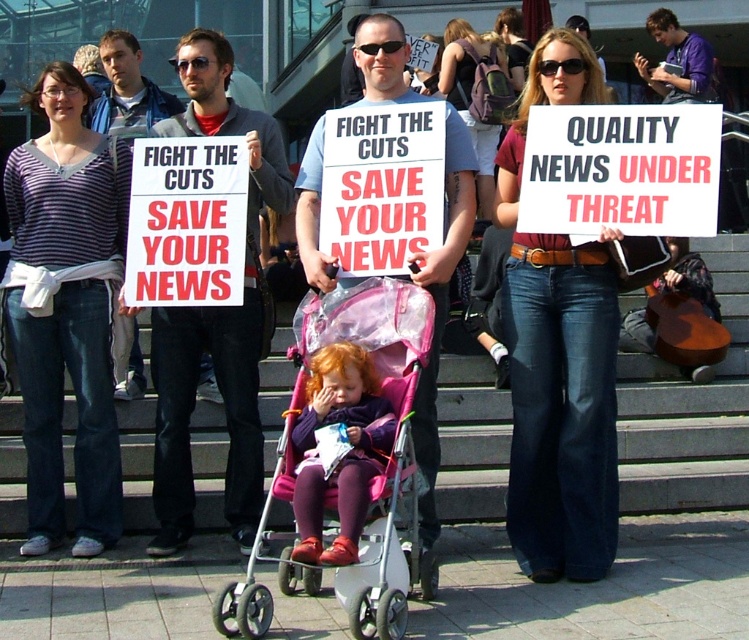
Is white paper sign at center shorter than purple fleece jacket at center?

Incorrect, white paper sign at center's height does not fall short of purple fleece jacket at center's.

Who is more forward, (139, 225) or (300, 547)?

Point (300, 547) is more forward.

At what (x,y) coordinates should I click in order to perform the action: click on white paper sign at center. Please return your answer as a coordinate pair (x, y). This screenshot has height=640, width=749. Looking at the image, I should click on (187, 221).

Locate an element on the screen. This screenshot has height=640, width=749. white paper sign at center is located at coordinates (187, 221).

Who is shorter, matte blue t-shirt at center or purple fleece jacket at center?

Standing shorter between the two is purple fleece jacket at center.

Which of these two, matte blue t-shirt at center or purple fleece jacket at center, stands taller?

matte blue t-shirt at center is taller.

Find the location of a particular element. The image size is (749, 640). matte blue t-shirt at center is located at coordinates (440, 310).

Who is higher up, matte gray sweater at center or purple fleece jacket at center?

matte gray sweater at center is higher up.

Who is more distant from viewer, (169, 419) or (345, 394)?

The point (169, 419) is more distant.

Where is `matte gray sweater at center`? This screenshot has height=640, width=749. matte gray sweater at center is located at coordinates (215, 314).